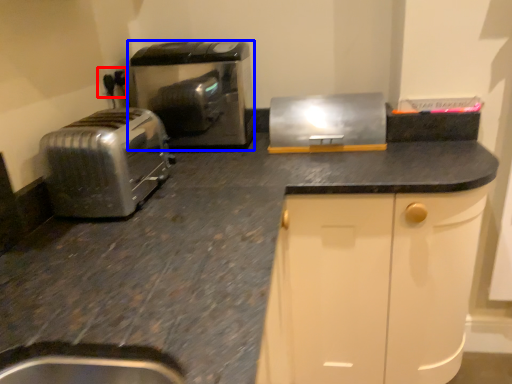
Question: Which object is further to the camera taking this photo, electric outlet (highlighted by a red box) or home appliance (highlighted by a blue box)?

Choices:
 (A) electric outlet
 (B) home appliance

Answer: (A)